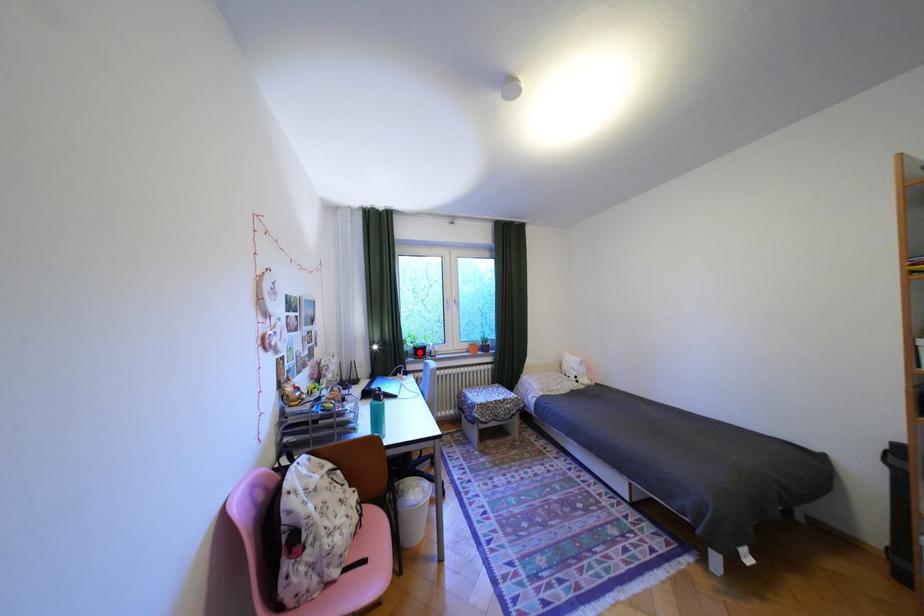
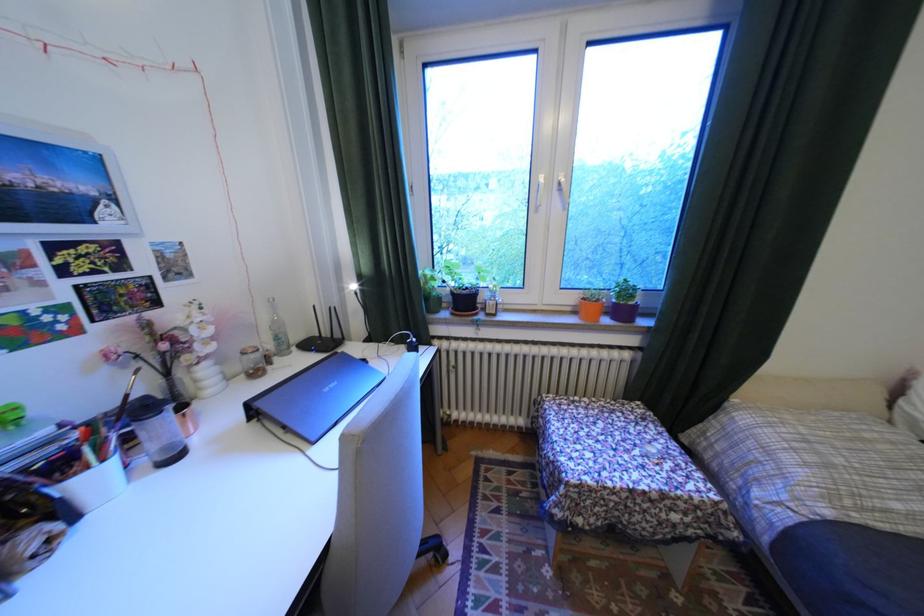
Question: I am providing you with two images of the same scene from different viewpoints. In image1, a red point is highlighted. Considering the same 3D point in image2, which of the following is correct?

Choices:
 (A) It is closer
 (B) It is farther

Answer: (A)